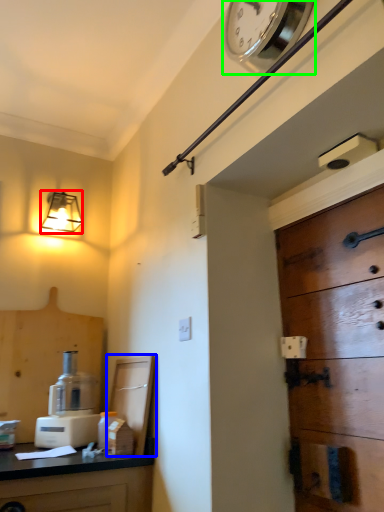
Question: Based on their relative distances, which object is farther from lamp (highlighted by a red box)? Choose from cabinetry (highlighted by a blue box) and clock (highlighted by a green box).

Choices:
 (A) cabinetry
 (B) clock

Answer: (B)